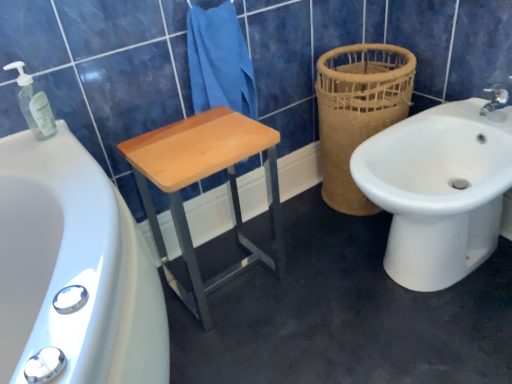
Question: From the image's perspective, is blue cotton towel at center above or below transparent plastic soap dispenser at upper left?

Choices:
 (A) above
 (B) below

Answer: (A)

Question: Based on their positions, is blue cotton towel at center located to the left or right of transparent plastic soap dispenser at upper left?

Choices:
 (A) right
 (B) left

Answer: (A)

Question: Which of these objects is positioned farthest from the blue cotton towel at center?

Choices:
 (A) brown woven basket at right
 (B) transparent plastic soap dispenser at upper left
 (C) light wood/matte stool at center
 (D) white ceramic bidet at right

Answer: (D)

Question: Which object is the closest to the brown woven basket at right?

Choices:
 (A) transparent plastic soap dispenser at upper left
 (B) white ceramic bidet at right
 (C) light wood/matte stool at center
 (D) blue cotton towel at center

Answer: (B)